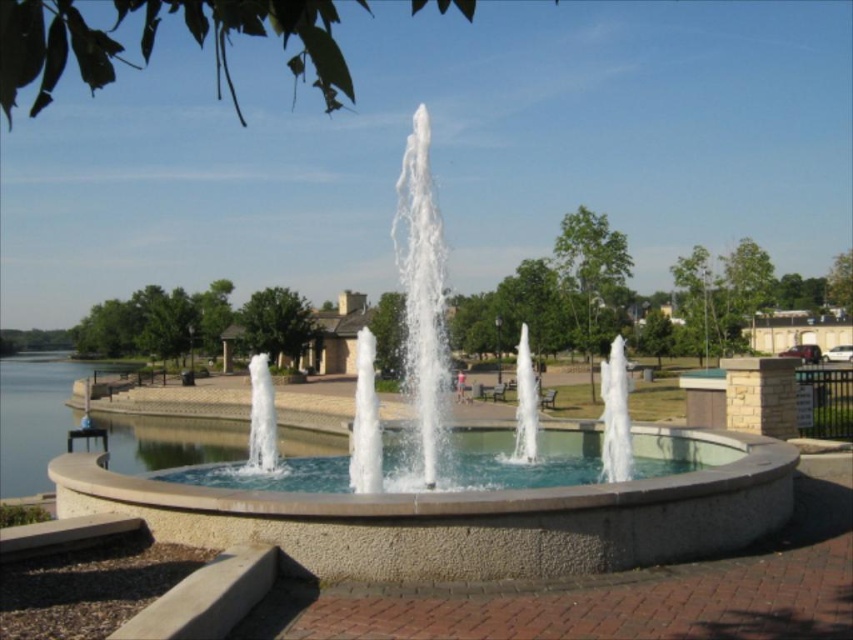
You are standing in the park and want to approach the white stone fountain at center. If your walking speed is 1.2 meters per second, how many seconds will it take you to reach the fountain?

The white stone fountain at center is 5.49 meters away from the viewer. At a walking speed of 1.2 meters per second, it would take approximately 4.58 seconds to reach the fountain.